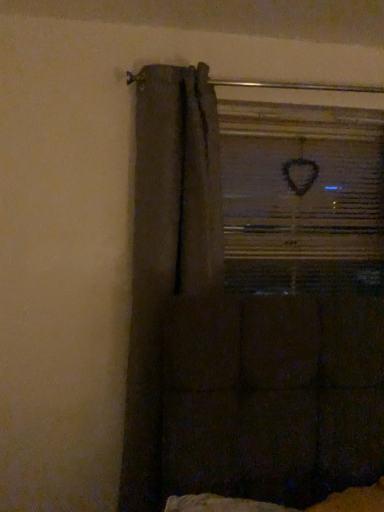
Describe the element at coordinates (302, 196) in the screenshot. Image resolution: width=384 pixels, height=512 pixels. I see `clear glass window at upper center` at that location.

Find the location of `clear glass window at upper center`. clear glass window at upper center is located at coordinates (302, 196).

What do you see at coordinates (167, 250) in the screenshot?
I see `dark fabric curtain at left` at bounding box center [167, 250].

The image size is (384, 512). Identify the location of dark fabric curtain at left. (167, 250).

In order to face dark fabric curtain at left, should I rotate leftwards or rightwards?

Rotate your view left by about 2.541°.

The height and width of the screenshot is (512, 384). Find the location of `clear glass window at upper center`. clear glass window at upper center is located at coordinates (302, 196).

Considering the relative positions of dark fabric curtain at left and clear glass window at upper center in the image provided, is dark fabric curtain at left to the left of clear glass window at upper center from the viewer's perspective?

Yes, dark fabric curtain at left is to the left of clear glass window at upper center.

Is dark fabric curtain at left in front of clear glass window at upper center?

Yes, dark fabric curtain at left is closer to the camera.

Between point (195, 204) and point (338, 212), which one is positioned in front?

The point (195, 204) is in front.

From the image's perspective, which one is positioned lower, dark fabric curtain at left or clear glass window at upper center?

From the image's view, dark fabric curtain at left is below.

From a real-world perspective, is dark fabric curtain at left physically above clear glass window at upper center?

No, from a real-world perspective, dark fabric curtain at left is not on top of clear glass window at upper center.

Is dark fabric curtain at left wider than clear glass window at upper center?

Indeed, dark fabric curtain at left has a greater width compared to clear glass window at upper center.

From the picture: Considering the relative sizes of dark fabric curtain at left and clear glass window at upper center in the image provided, is dark fabric curtain at left taller than clear glass window at upper center?

Yes.

Considering the relative sizes of dark fabric curtain at left and clear glass window at upper center in the image provided, is dark fabric curtain at left smaller than clear glass window at upper center?

No, dark fabric curtain at left is not smaller than clear glass window at upper center.

Is clear glass window at upper center a part of dark fabric curtain at left?

No, clear glass window at upper center is not a part of dark fabric curtain at left.

Can you see dark fabric curtain at left touching clear glass window at upper center?

No, dark fabric curtain at left is not touching clear glass window at upper center.

Could you tell me if dark fabric curtain at left is turned towards clear glass window at upper center?

No, dark fabric curtain at left is not aimed at clear glass window at upper center.

Where is `curtain located in front of the clear glass window at upper center`? curtain located in front of the clear glass window at upper center is located at coordinates (167, 250).

Which object is positioned more to the right, clear glass window at upper center or dark fabric curtain at left?

Positioned to the right is clear glass window at upper center.

Is the position of clear glass window at upper center less distant than that of dark fabric curtain at left?

No, clear glass window at upper center is behind dark fabric curtain at left.

Considering the points (225, 130) and (147, 192), which point is behind, point (225, 130) or point (147, 192)?

The point (225, 130) is farther.

From the image's perspective, does clear glass window at upper center appear lower than dark fabric curtain at left?

No, from the image's perspective, clear glass window at upper center is not beneath dark fabric curtain at left.

From a real-world perspective, between clear glass window at upper center and dark fabric curtain at left, who is vertically lower?

dark fabric curtain at left, from a real-world perspective.

Can you confirm if clear glass window at upper center is wider than dark fabric curtain at left?

No.

Who is taller, clear glass window at upper center or dark fabric curtain at left?

dark fabric curtain at left is taller.

Considering the relative sizes of clear glass window at upper center and dark fabric curtain at left in the image provided, is clear glass window at upper center smaller than dark fabric curtain at left?

Indeed, clear glass window at upper center has a smaller size compared to dark fabric curtain at left.

Can we say clear glass window at upper center lies outside dark fabric curtain at left?

Indeed, clear glass window at upper center is completely outside dark fabric curtain at left.

Does clear glass window at upper center touch dark fabric curtain at left?

They are not placed beside each other.

Could you tell me if clear glass window at upper center is turned towards dark fabric curtain at left?

No, clear glass window at upper center is not facing towards dark fabric curtain at left.

The height and width of the screenshot is (512, 384). I want to click on window frame above the dark fabric curtain at left (from a real-world perspective), so tap(302, 196).

I want to click on window frame behind the dark fabric curtain at left, so click(x=302, y=196).

Image resolution: width=384 pixels, height=512 pixels. What are the coordinates of `curtain below the clear glass window at upper center (from the image's perspective)` in the screenshot? It's located at (167, 250).